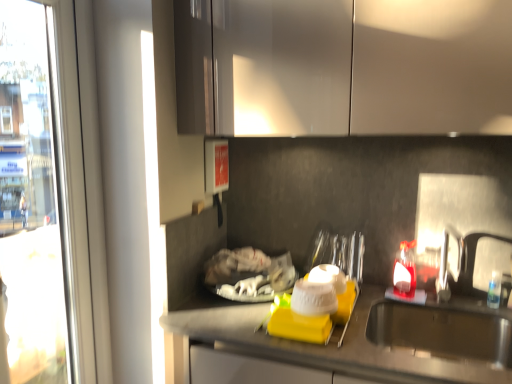
Question: Considering the relative positions of stainless steel sink at lower right and glossy white cabinets at upper center in the image provided, is stainless steel sink at lower right to the left or to the right of glossy white cabinets at upper center?

Choices:
 (A) right
 (B) left

Answer: (A)

Question: From a real-world perspective, relative to glossy white cabinets at upper center, is stainless steel sink at lower right vertically above or below?

Choices:
 (A) below
 (B) above

Answer: (A)

Question: Which object is the farthest from the satin nickel faucet at right?

Choices:
 (A) translucent glass bottle at right
 (B) transparent glass window at left
 (C) stainless steel sink at lower right
 (D) glossy white cabinets at upper center

Answer: (B)

Question: Which of these objects is positioned farthest from the glossy white cabinets at upper center?

Choices:
 (A) satin nickel faucet at right
 (B) stainless steel sink at lower right
 (C) transparent glass window at left
 (D) translucent glass bottle at right

Answer: (D)